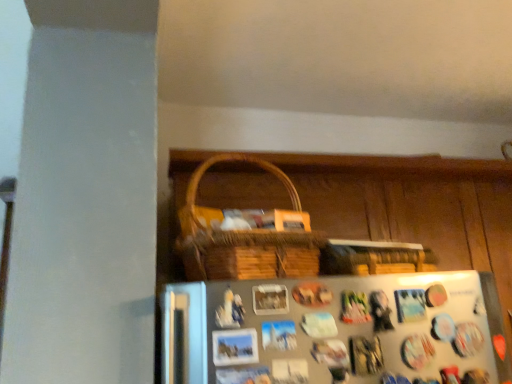
Question: In terms of height, does metallic silver fridge at lower center look taller or shorter compared to woven wood basket at upper center?

Choices:
 (A) tall
 (B) short

Answer: (B)

Question: Does point (406, 350) appear closer or farther from the camera than point (395, 349)?

Choices:
 (A) farther
 (B) closer

Answer: (A)

Question: From the image's perspective, is metallic silver fridge at lower center located above or below woven wood basket at upper center?

Choices:
 (A) below
 (B) above

Answer: (B)

Question: From a real-world perspective, is woven wood basket at upper center physically located above or below metallic silver fridge at lower center?

Choices:
 (A) above
 (B) below

Answer: (A)

Question: Is woven wood basket at upper center taller or shorter than metallic silver fridge at lower center?

Choices:
 (A) tall
 (B) short

Answer: (A)

Question: From the image's perspective, is woven wood basket at upper center above or below metallic silver fridge at lower center?

Choices:
 (A) above
 (B) below

Answer: (B)

Question: Is woven wood basket at upper center to the left or to the right of metallic silver fridge at lower center in the image?

Choices:
 (A) right
 (B) left

Answer: (A)